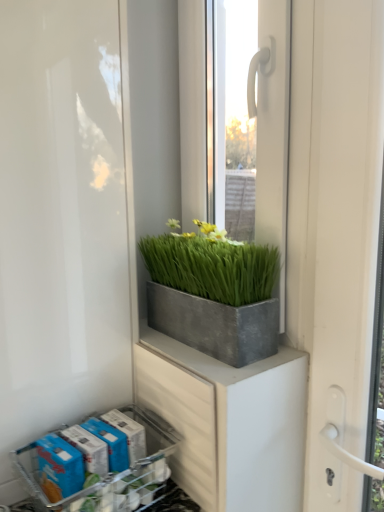
At what (x,y) coordinates should I click in order to perform the action: click on white matte screen door at left. Please return your answer as a coordinate pair (x, y). Image resolution: width=384 pixels, height=512 pixels. Looking at the image, I should click on (60, 221).

What do you see at coordinates (254, 120) in the screenshot? This screenshot has height=512, width=384. I see `clear glass window at center` at bounding box center [254, 120].

I want to click on metallic gray flower box at lower left, so click(110, 473).

How many degrees apart are the facing directions of metallic gray flower box at lower left and white matte screen door at left?

The angular difference between metallic gray flower box at lower left and white matte screen door at left is 0.67 degrees.

From the image's perspective, would you say metallic gray flower box at lower left is positioned over white matte screen door at left?

No, from the image's perspective, metallic gray flower box at lower left is not above white matte screen door at left.

Which of these two, metallic gray flower box at lower left or white matte screen door at left, stands taller?

white matte screen door at left is taller.

Which is less distant, (x=131, y=414) or (x=6, y=450)?

Point (x=131, y=414).

Is metallic gray flower box at lower left not near clear glass window at center?

No, metallic gray flower box at lower left is not far away from clear glass window at center.

In order to click on flower box on the left of clear glass window at center in this screenshot , I will do `click(110, 473)`.

Consider the image. From a real-world perspective, is metallic gray flower box at lower left positioned above or below clear glass window at center?

In terms of real-world spatial position, metallic gray flower box at lower left is below clear glass window at center.

Is metallic gray flower box at lower left thinner than clear glass window at center?

No.

Considering the relative sizes of clear glass window at center and white matte screen door at left in the image provided, is clear glass window at center shorter than white matte screen door at left?

Indeed, clear glass window at center has a lesser height compared to white matte screen door at left.

Choose the correct answer: Is clear glass window at center inside white matte screen door at left or outside it?

The correct answer is: outside.

Would you say clear glass window at center is a long distance from white matte screen door at left?

clear glass window at center is actually quite close to white matte screen door at left.

Which is correct: clear glass window at center is inside metallic gray flower box at lower left, or outside of it?

clear glass window at center is located beyond the bounds of metallic gray flower box at lower left.

From a real-world perspective, is clear glass window at center over metallic gray flower box at lower left?

Yes, from a real-world perspective, clear glass window at center is on top of metallic gray flower box at lower left.

Between clear glass window at center and metallic gray flower box at lower left, which one has larger width?

Wider between the two is metallic gray flower box at lower left.

Does clear glass window at center appear on the right side of metallic gray flower box at lower left?

Correct, you'll find clear glass window at center to the right of metallic gray flower box at lower left.

Can you confirm if white matte screen door at left is smaller than metallic gray flower box at lower left?

Actually, white matte screen door at left might be larger than metallic gray flower box at lower left.

Which of these two, white matte screen door at left or metallic gray flower box at lower left, is wider?

white matte screen door at left is wider.

From the image's perspective, between white matte screen door at left and metallic gray flower box at lower left, which one is located above?

white matte screen door at left appears higher in the image.

Is white matte screen door at left inside or outside of clear glass window at center?

white matte screen door at left is located beyond the bounds of clear glass window at center.

Which is farther from the camera, (54, 335) or (217, 108)?

Point (217, 108)

Considering the sizes of objects white matte screen door at left and clear glass window at center in the image provided, who is wider, white matte screen door at left or clear glass window at center?

Wider between the two is white matte screen door at left.

From the image's perspective, which one is positioned higher, white matte screen door at left or clear glass window at center?

From the image's view, clear glass window at center is above.

In order to click on screen door that is above the metallic gray flower box at lower left (from a real-world perspective) in this screenshot , I will do `click(60, 221)`.

This screenshot has height=512, width=384. What are the coordinates of `flower box lying in front of the clear glass window at center` in the screenshot? It's located at (110, 473).

Estimate the real-world distances between objects in this image. Which object is further from metallic gray flower box at lower left, white matte screen door at left or clear glass window at center?

clear glass window at center is positioned further to the anchor metallic gray flower box at lower left.

Looking at the image, which one is located closer to white matte screen door at left, clear glass window at center or metallic gray flower box at lower left?

Based on the image, metallic gray flower box at lower left appears to be nearer to white matte screen door at left.

Which object lies further to the anchor point clear glass window at center, white matte screen door at left or metallic gray flower box at lower left?

Based on the image, metallic gray flower box at lower left appears to be further to clear glass window at center.

Which object lies further to the anchor point clear glass window at center, metallic gray flower box at lower left or white matte screen door at left?

metallic gray flower box at lower left.

From the image, which object appears to be farther from white matte screen door at left, metallic gray flower box at lower left or clear glass window at center?

Based on the image, clear glass window at center appears to be further to white matte screen door at left.

Estimate the real-world distances between objects in this image. Which object is further from metallic gray flower box at lower left, clear glass window at center or white matte screen door at left?

The object further to metallic gray flower box at lower left is clear glass window at center.

The image size is (384, 512). I want to click on screen door between clear glass window at center and metallic gray flower box at lower left from top to bottom, so coord(60,221).